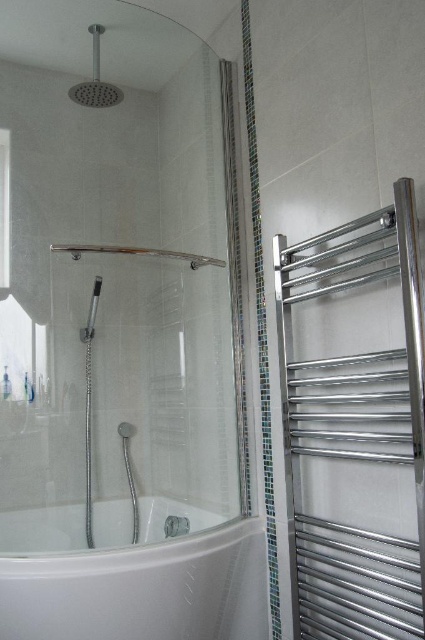
In the scene shown: Between white glossy bathtub at lower left and satin nickel showerhead at upper left, which one appears on the right side from the viewer's perspective?

white glossy bathtub at lower left

Does white glossy bathtub at lower left have a greater width compared to satin nickel showerhead at upper left?

Yes.

The width and height of the screenshot is (425, 640). What do you see at coordinates (141, 589) in the screenshot?
I see `white glossy bathtub at lower left` at bounding box center [141, 589].

In order to click on white glossy bathtub at lower left in this screenshot , I will do `click(141, 589)`.

Find the location of a particular element. This screenshot has height=640, width=425. polished chrome towel rack at right is located at coordinates (354, 424).

Which of these two, polished chrome towel rack at right or white glossy bathtub at lower left, stands shorter?

Standing shorter between the two is white glossy bathtub at lower left.

Between point (402, 264) and point (78, 572), which one is positioned in front?

Point (402, 264)

Where is `polished chrome towel rack at right`? This screenshot has height=640, width=425. polished chrome towel rack at right is located at coordinates (354, 424).

Between white glossy bathtub at lower left and clear glass shower curtain at center, which one is positioned lower?

white glossy bathtub at lower left is lower down.

Does point (214, 616) come behind point (221, 104)?

No, it is in front of (221, 104).

The height and width of the screenshot is (640, 425). Identify the location of white glossy bathtub at lower left. (141, 589).